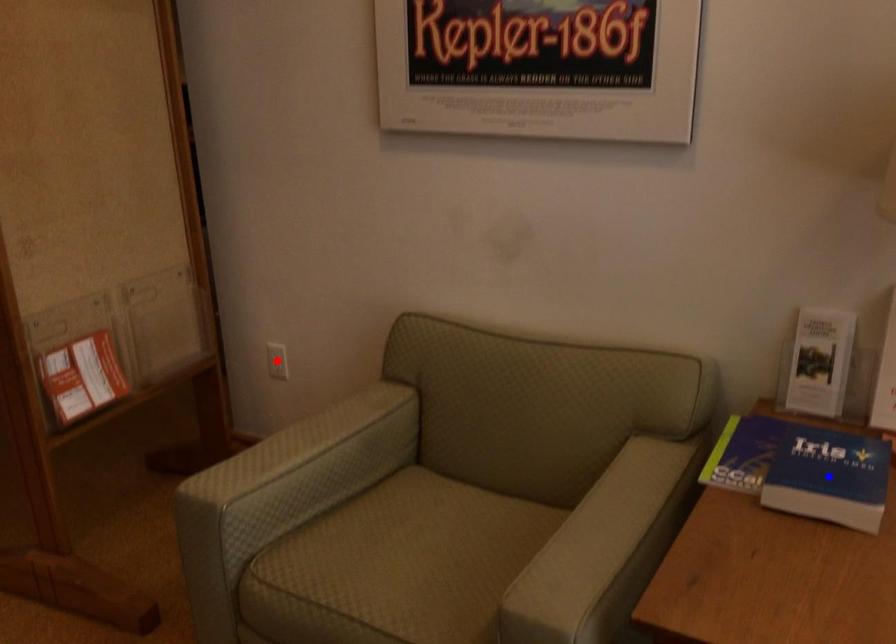
Question: Two points are marked on the image. Which point is closer to the camera?

Choices:
 (A) Blue point is closer.
 (B) Red point is closer.

Answer: (A)